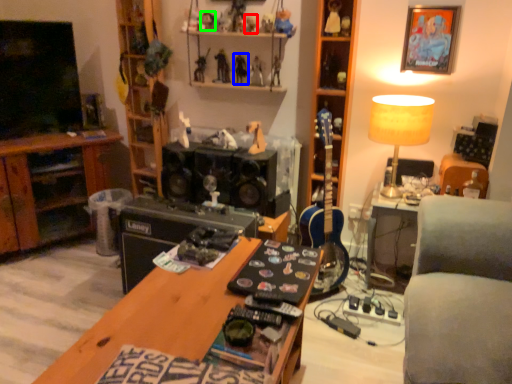
Question: Which is nearer to the toy (highlighted by a red box)? toy (highlighted by a blue box) or toy (highlighted by a green box).

Choices:
 (A) toy
 (B) toy

Answer: (A)